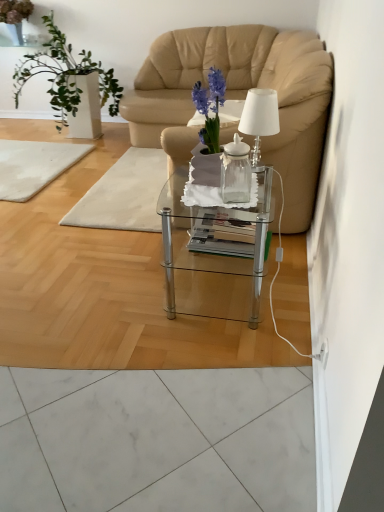
Question: Is white glossy vase at left completely or partially inside white marble mat at left, the 1th mat positioned from the left?

Choices:
 (A) no
 (B) yes

Answer: (A)

Question: Would you consider white marble mat at left, which is the second mat in right-to-left order, to be distant from white glossy vase at left?

Choices:
 (A) no
 (B) yes

Answer: (A)

Question: Is the depth of white marble mat at left, the 1th mat positioned from the left, less than that of white glossy vase at left?

Choices:
 (A) yes
 (B) no

Answer: (A)

Question: From the image's perspective, is white marble mat at left, which is the second mat in right-to-left order, located beneath white glossy vase at left?

Choices:
 (A) no
 (B) yes

Answer: (B)

Question: Is white marble mat at left, the 1th mat positioned from the left, aimed at white glossy vase at left?

Choices:
 (A) no
 (B) yes

Answer: (A)

Question: Is white glossy vase at left at the back of white marble mat at left, which is the second mat in right-to-left order?

Choices:
 (A) no
 (B) yes

Answer: (B)

Question: Considering the relative sizes of translucent glass table at center, acting as the 2th mat starting from the left, and clear glass coffee table at center in the image provided, is translucent glass table at center, acting as the 2th mat starting from the left, bigger than clear glass coffee table at center?

Choices:
 (A) yes
 (B) no

Answer: (B)

Question: Is the position of translucent glass table at center, the 1th mat in the right-to-left sequence, more distant than that of clear glass coffee table at center?

Choices:
 (A) no
 (B) yes

Answer: (B)

Question: From a real-world perspective, is translucent glass table at center, the 1th mat in the right-to-left sequence, located beneath clear glass coffee table at center?

Choices:
 (A) yes
 (B) no

Answer: (A)

Question: Could you tell me if translucent glass table at center, the 1th mat in the right-to-left sequence, is turned towards clear glass coffee table at center?

Choices:
 (A) no
 (B) yes

Answer: (A)

Question: From the image's perspective, does translucent glass table at center, the 1th mat in the right-to-left sequence, appear higher than clear glass coffee table at center?

Choices:
 (A) yes
 (B) no

Answer: (A)

Question: Is translucent glass table at center, acting as the 2th mat starting from the left, next to clear glass coffee table at center and touching it?

Choices:
 (A) no
 (B) yes

Answer: (A)

Question: Considering the relative sizes of transparent glass vase at center and translucent glass table at center, acting as the 2th mat starting from the left, in the image provided, is transparent glass vase at center bigger than translucent glass table at center, acting as the 2th mat starting from the left,?

Choices:
 (A) no
 (B) yes

Answer: (A)